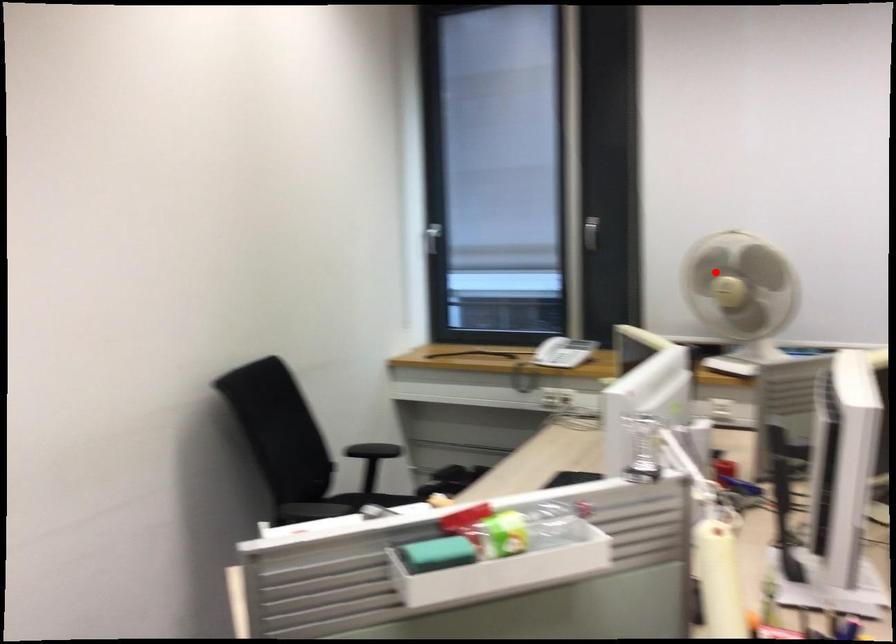
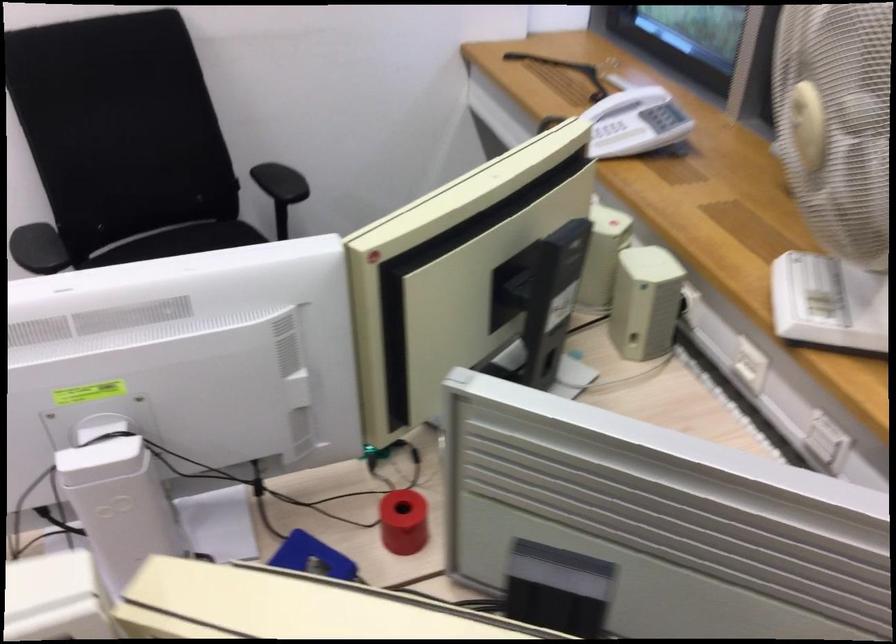
Where in the second image is the point corresponding to the highlighted location from the first image?

(807, 125)